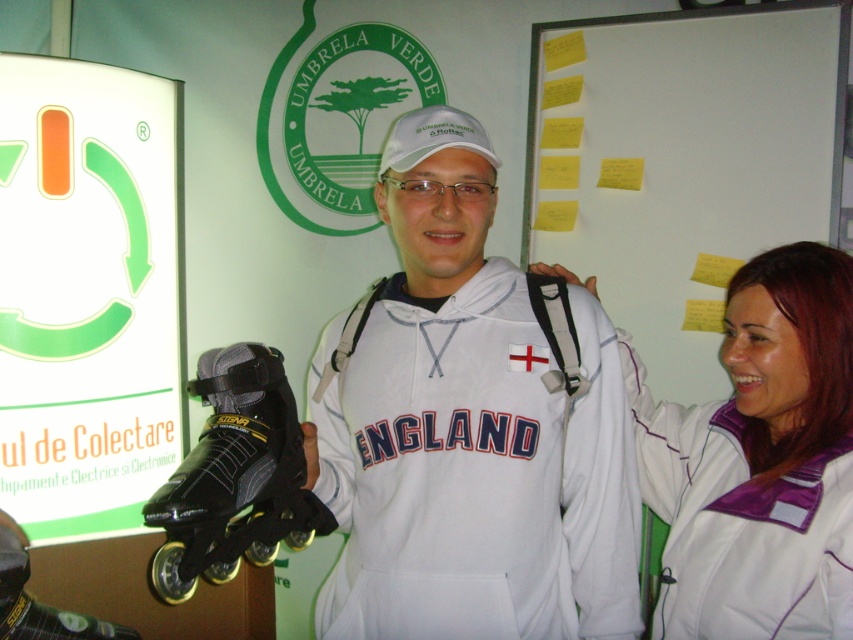
You are organizing a photo shoot and need to place the white matte sweatshirt at center and the yellow paper at upper center in a way that maintains their visibility. Given their sizes, which object should be placed closer to the camera to ensure both are clearly visible?

The white matte sweatshirt at center should be placed closer to the camera because it is smaller in size compared to the yellow paper at upper center, ensuring both objects appear similarly sized in the photo.

You are organizing a photo shoot and need to ensure that the white matte sweatshirt at center is visible in the frame. The yellow paper at upper center is part of the backdrop. Considering their relative heights, which object should be placed lower to ensure both are visible without overlapping?

The white matte sweatshirt at center has a lesser height compared to the yellow paper at upper center. To ensure both are visible without overlapping, the yellow paper at upper center should be placed lower so that the shorter white matte sweatshirt at center can be positioned below it without obstruction.